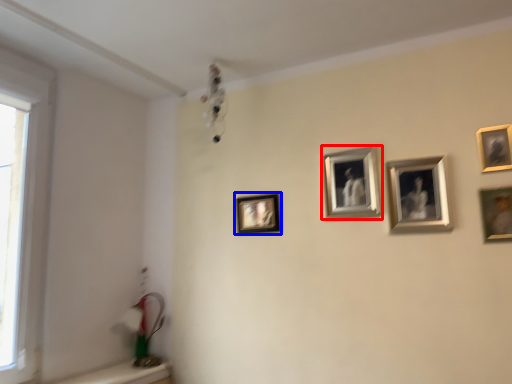
Question: Which object appears closest to the camera in this image, picture frame (highlighted by a red box) or picture frame (highlighted by a blue box)?

Choices:
 (A) picture frame
 (B) picture frame

Answer: (A)